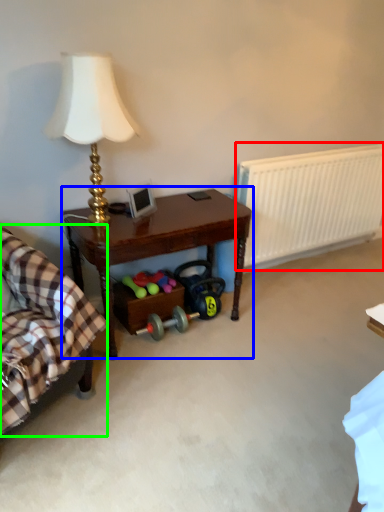
Question: Considering the real-world distances, which object is closest to radiator (highlighted by a red box)? table (highlighted by a blue box) or rocking chair (highlighted by a green box).

Choices:
 (A) table
 (B) rocking chair

Answer: (A)